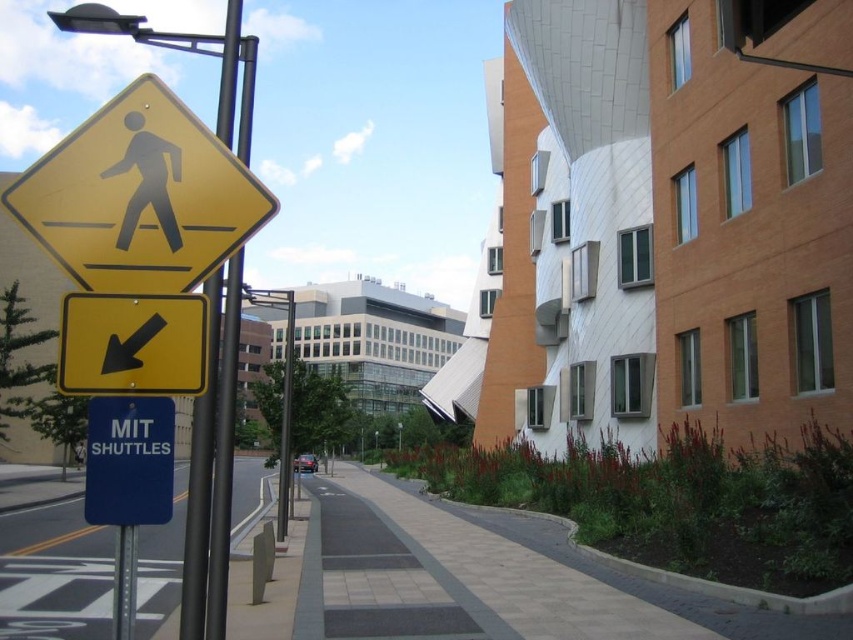
Does metallic pole at left lie in front of black plastic pedestrian sign at upper left?

No, it is not.

This screenshot has height=640, width=853. I want to click on metallic pole at left, so click(223, 456).

In the scene shown: Does yellow matte arrow at lower left have a lesser height compared to metallic pole at lower left?

Indeed, yellow matte arrow at lower left has a lesser height compared to metallic pole at lower left.

Does yellow matte arrow at lower left have a smaller size compared to metallic pole at lower left?

Incorrect, yellow matte arrow at lower left is not smaller in size than metallic pole at lower left.

Find the location of a particular element. yellow matte arrow at lower left is located at coordinates (132, 344).

The height and width of the screenshot is (640, 853). Identify the location of yellow matte arrow at lower left. (132, 344).

Does point (80, 266) come in front of point (119, 500)?

No, it is not.

Does yellow matte pedestrian crossing sign at upper left appear over blue metallic sign at lower left?

Yes, yellow matte pedestrian crossing sign at upper left is above blue metallic sign at lower left.

Between point (140, 186) and point (146, 499), which one is positioned in front?

Point (146, 499) is more forward.

Identify the location of yellow matte pedestrian crossing sign at upper left. [x=140, y=196].